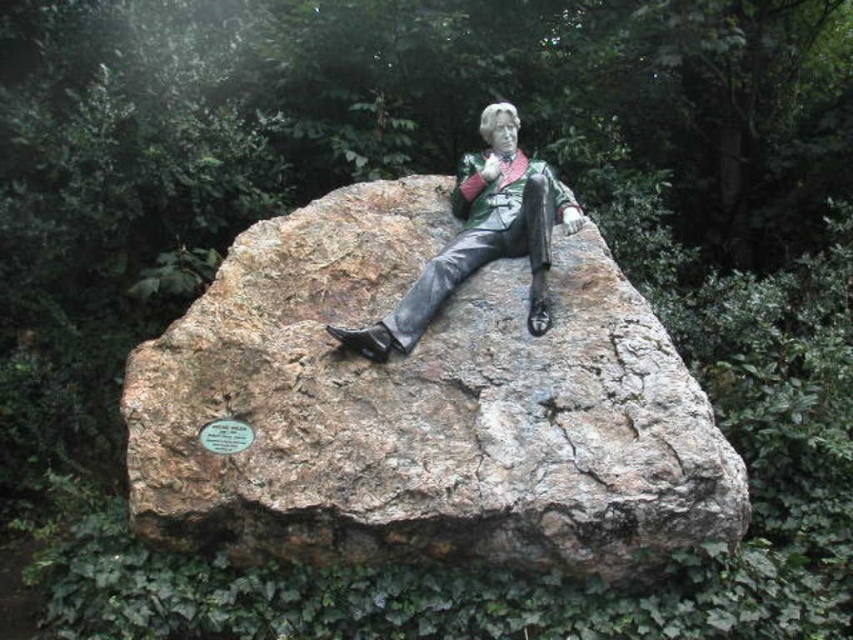
You are a tour guide explaining the statue and its base to visitors. You want to clarify the spatial relationship between the rustic stone at center and the bronze statue at center. Which object is closer to the visitors standing in front of the display?

The rustic stone at center is closer to the visitors because it is positioned in front of the bronze statue at center.

What are the coordinates of the rustic stone at center in the image?

The rustic stone at center is located at coordinates (x=422, y=406).

You are an artist planning to create a miniature model of the statue and its base. The base must be proportionally accurate to the original. If the bronze statue at center in your model is 10 cm tall, how tall should the rustic stone at center be?

The rustic stone at center is bigger than the bronze statue at center. Since the original rustic stone is larger, in the model, the rustic stone at center should also be taller than 10 cm to maintain proportionality.